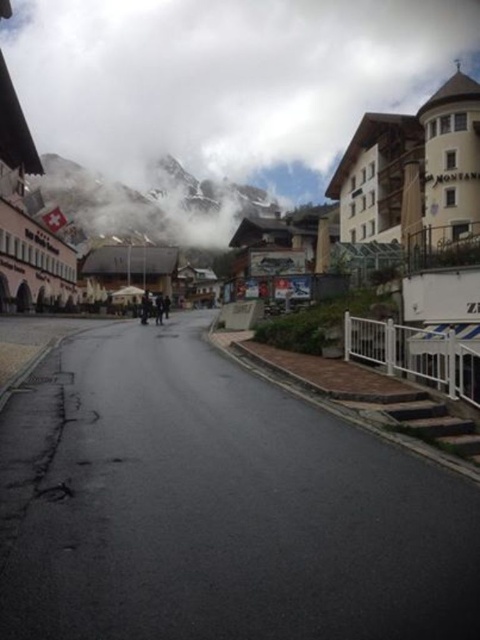
Between white fluffy cloud at upper center and snowy rocky mountain at upper center, which one is positioned lower?

snowy rocky mountain at upper center is below.

Does white fluffy cloud at upper center appear on the right side of snowy rocky mountain at upper center?

Yes, white fluffy cloud at upper center is to the right of snowy rocky mountain at upper center.

Find the location of a particular element. The image size is (480, 640). white fluffy cloud at upper center is located at coordinates (228, 77).

You are a GUI agent. You are given a task and a screenshot of the screen. Output one action in this format:
    pyautogui.click(x=<x>, y=<y>)
    Task: Click on the white fluffy cloud at upper center
    The height and width of the screenshot is (640, 480).
    Given the screenshot: What is the action you would take?
    pyautogui.click(x=228, y=77)

Is the position of white fluffy cloud at upper center more distant than that of dark gray fabric jacket at center?

Yes, white fluffy cloud at upper center is further from the viewer.

Can you confirm if white fluffy cloud at upper center is smaller than dark gray fabric jacket at center?

No.

Is point (204, 72) positioned before point (163, 305)?

No, it is not.

The width and height of the screenshot is (480, 640). Find the location of `white fluffy cloud at upper center`. white fluffy cloud at upper center is located at coordinates (228, 77).

Who is positioned more to the right, snowy rocky mountain at upper center or dark gray fabric jacket at center?

From the viewer's perspective, dark gray fabric jacket at center appears more on the right side.

Who is more forward, (162, 236) or (163, 305)?

Point (163, 305)

Who is more forward, (x=56, y=193) or (x=162, y=308)?

Point (x=162, y=308)

Where is `snowy rocky mountain at upper center`? snowy rocky mountain at upper center is located at coordinates (147, 200).